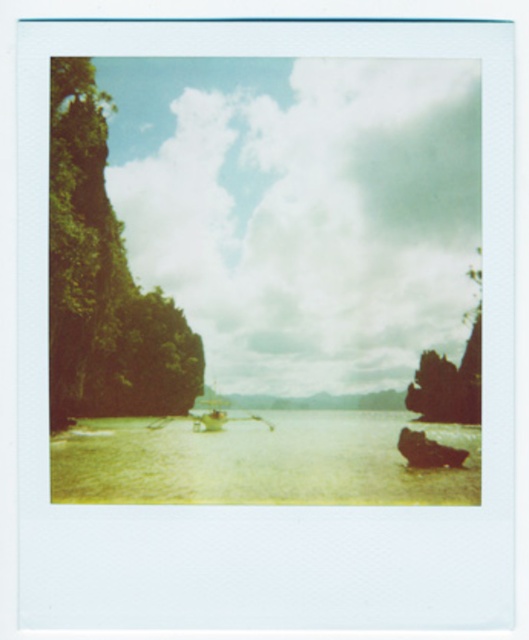
Question: Which point is farther to the camera?

Choices:
 (A) (451, 394)
 (B) (158, 387)
 (C) (324, 499)

Answer: (B)

Question: Which of the following is the farthest from the observer?

Choices:
 (A) dark brown rocky cliff at right
 (B) dark brown wooden boat at lower right
 (C) clear water at center
 (D) green matte boat at center

Answer: (A)

Question: Can you confirm if dark brown rocky cliff at right is positioned above dark brown wooden boat at lower right?

Choices:
 (A) no
 (B) yes

Answer: (B)

Question: Considering the relative positions of green leafy rock at left and dark brown rocky cliff at right in the image provided, where is green leafy rock at left located with respect to dark brown rocky cliff at right?

Choices:
 (A) right
 (B) left

Answer: (B)

Question: Is dark brown rocky cliff at right positioned in front of green matte boat at center?

Choices:
 (A) yes
 (B) no

Answer: (B)

Question: Which of the following is the farthest from the observer?

Choices:
 (A) green leafy rock at left
 (B) dark brown wooden boat at lower right

Answer: (B)